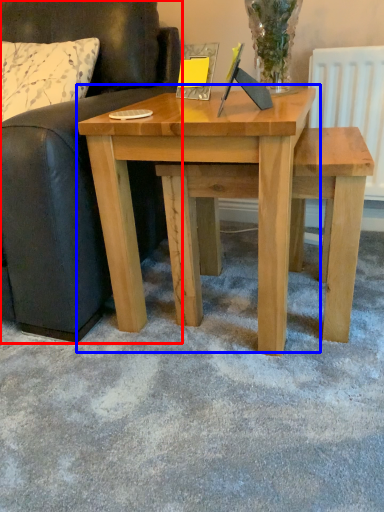
Question: Which point is closer to the camera, studio couch (highlighted by a red box) or table (highlighted by a blue box)?

Choices:
 (A) studio couch
 (B) table

Answer: (A)